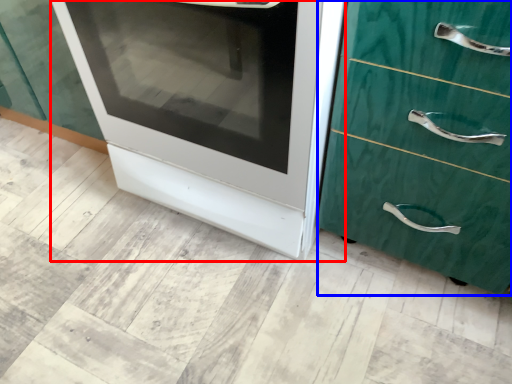
Question: Which object is further to the camera taking this photo, oven (highlighted by a red box) or chest of drawers (highlighted by a blue box)?

Choices:
 (A) oven
 (B) chest of drawers

Answer: (A)